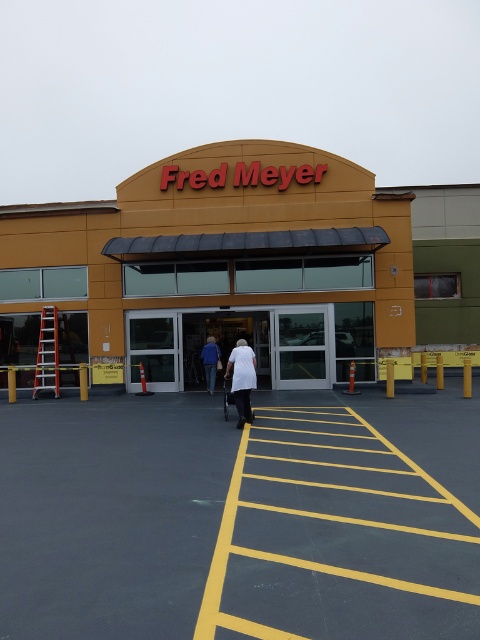
You are standing at the entrance of the Fred Meyer store and want to walk to the point marked at coordinate [248,403]. Which direction should you move relative to the point at [405,196]?

Since point [405,196] is closer to you than point [248,403], you should move away from the point at [405,196] to reach the point at [248,403].

You are standing in the parking lot of the Fred Meyer store. You see the yellow asphalt at center and the white matte jacket at center. Which object is closer to you?

The yellow asphalt at center is closer to you because it is in front of the white matte jacket at center.

You are standing at the entrance of the Fred Meyer store and notice two people wearing white clothing. The first person is wearing a white matte shirt at center, and the second is wearing a white matte jacket at center. Which of these two items of clothing appears narrower?

The white matte shirt at center appears narrower compared to the white matte jacket at center.